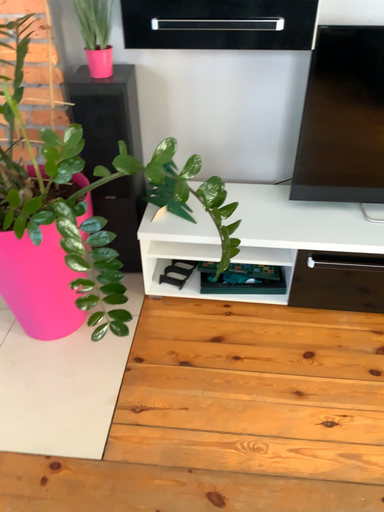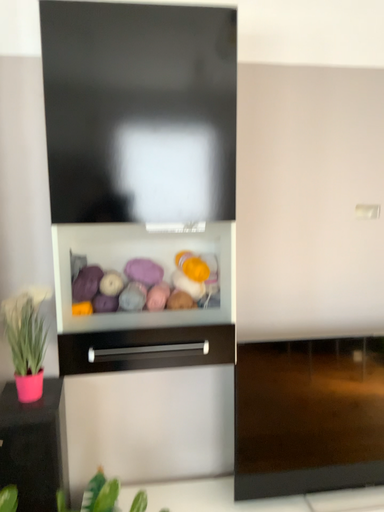
Question: Which way did the camera rotate in the video?

Choices:
 (A) rotated left
 (B) rotated right

Answer: (B)